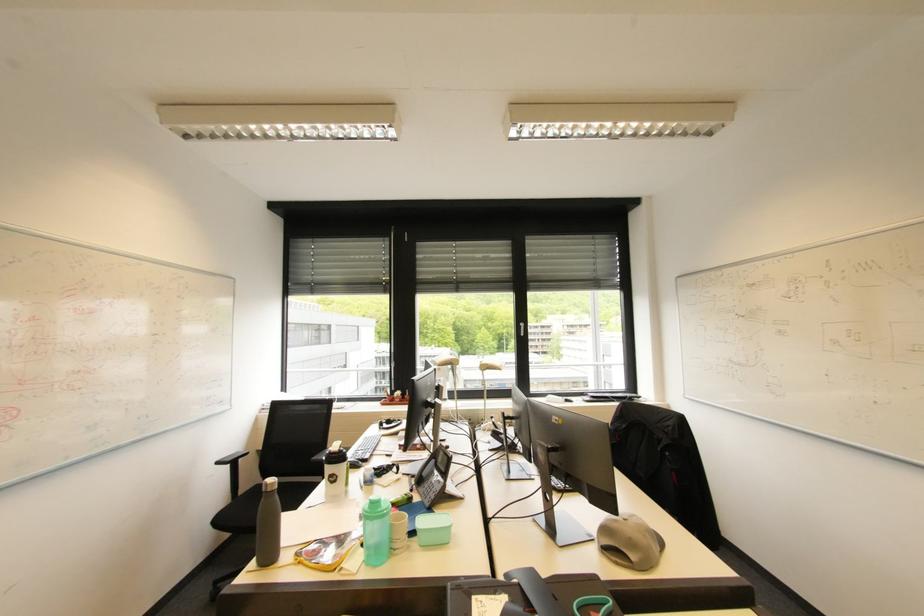
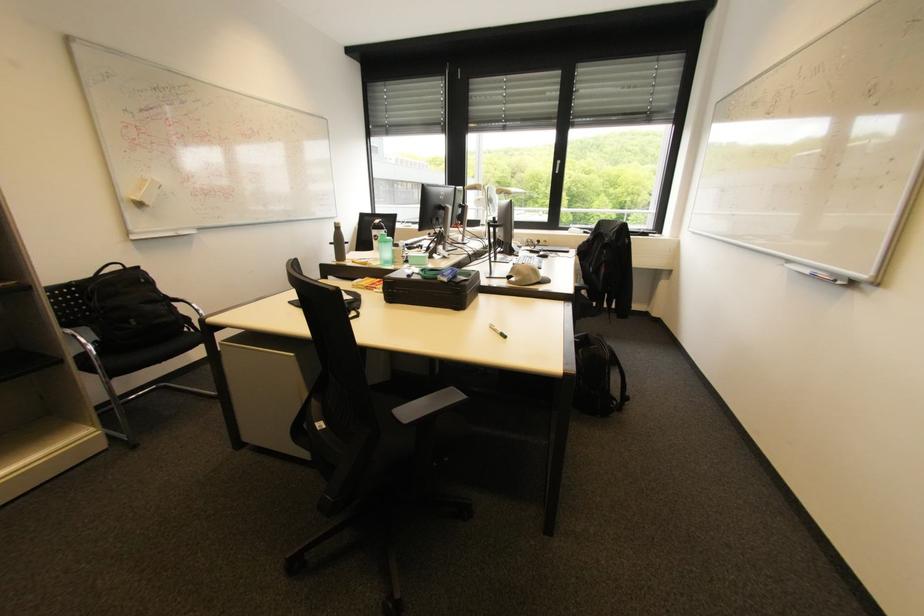
The point at (636, 540) is marked in the first image. Where is the corresponding point in the second image?

(524, 270)